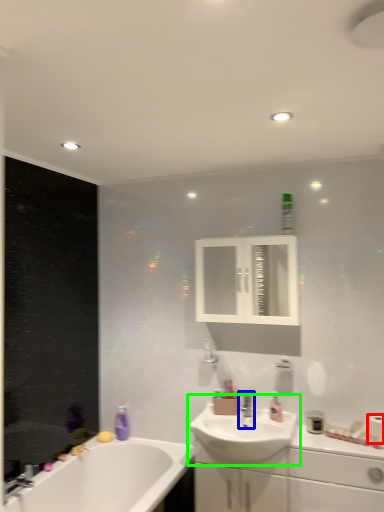
Question: Which object is positioned closest to toilet paper (highlighted by a red box)? Select from tap (highlighted by a blue box) and sink (highlighted by a green box).

Choices:
 (A) tap
 (B) sink

Answer: (B)